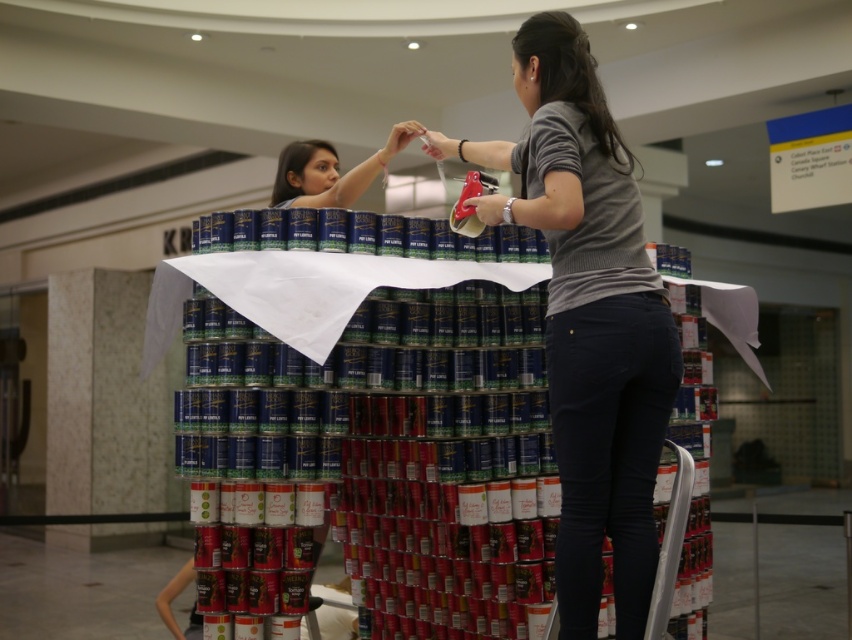
You are standing at the camera position and want to hand the gray knit sweater at center to someone behind you. Can you reach it without moving your position?

The gray knit sweater at center is 8.65 feet from the camera, which is too far to reach without moving. You will need to step closer to retrieve it.

You are a photographer trying to capture the two women interacting with the can pyramid. Based on their positions, which object from the scene is located to the right of the other? Specifically, is the gray knit sweater at center positioned to the right of the matte black hair at upper center, or vice versa?

The gray knit sweater at center is positioned on the right side of matte black hair at upper center according to the description.